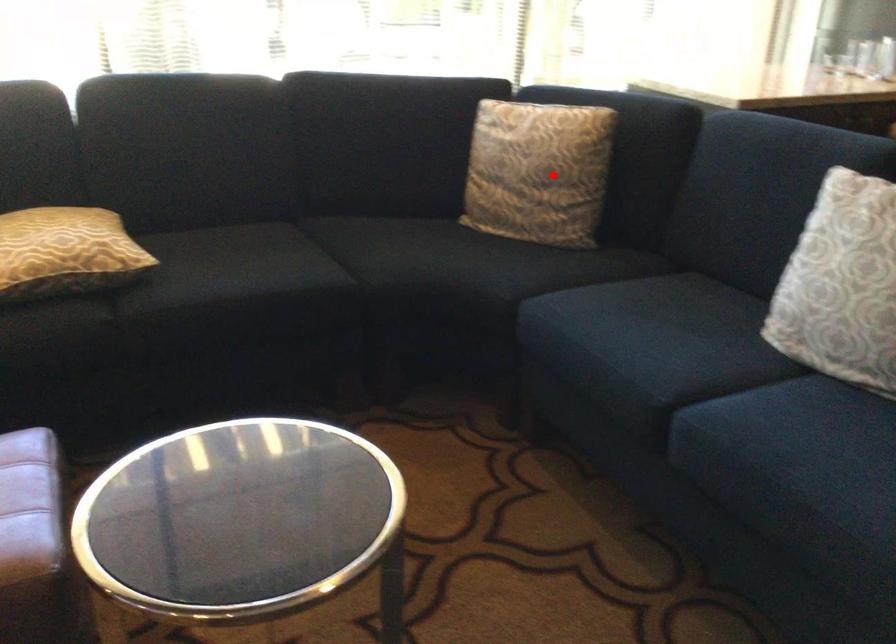
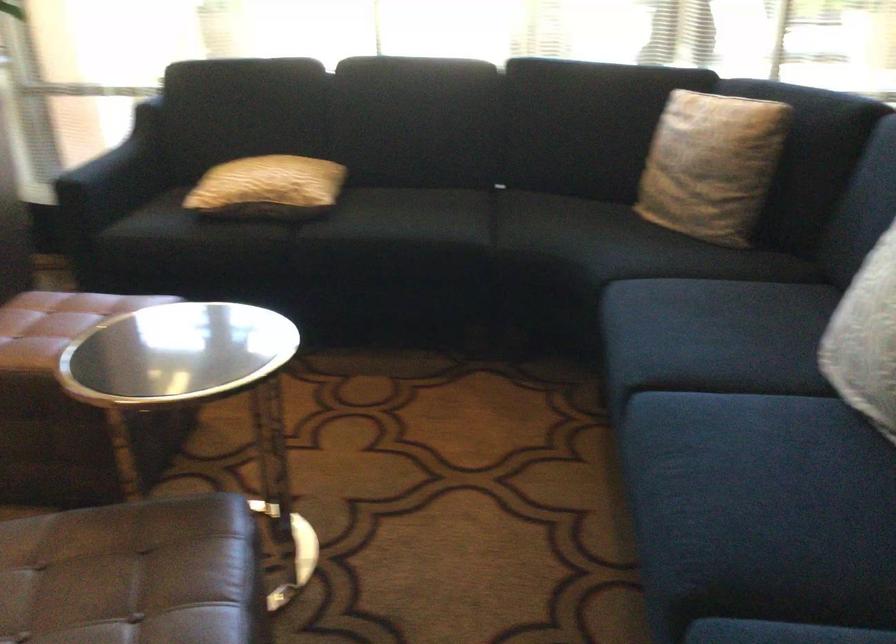
The point at the highlighted location is marked in the first image. Where is the corresponding point in the second image?

(711, 165)